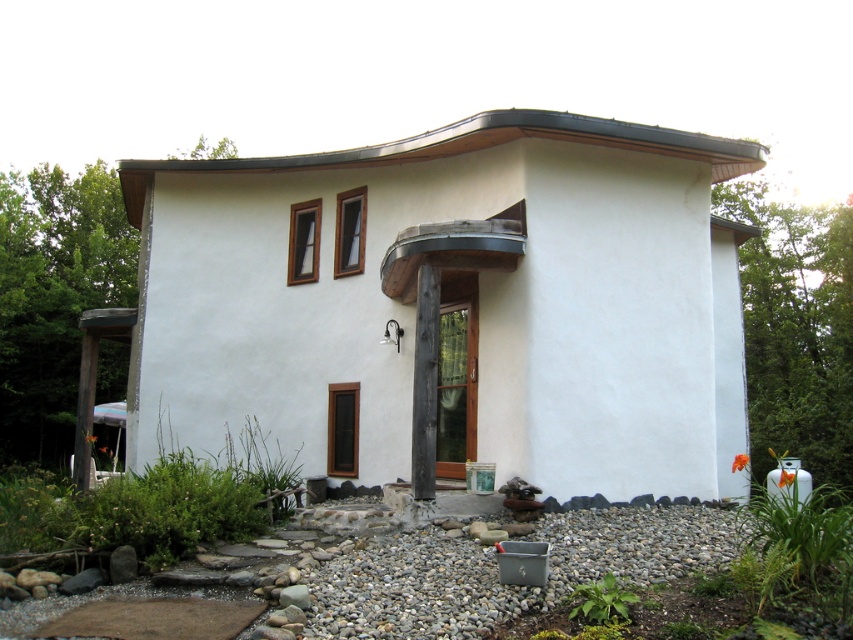
You are standing in front of the house and want to walk from the gravel pathway to the entrance door. There are two points marked on the path. The first point is at coordinate point (115, 573) and the second is at point (300, 593). Which point should you step on first as you approach the door?

You should step on point (115, 573) first because it is closer to you than point (300, 593) as you approach the door.

You are standing at the entrance of the modern house and want to place a new decorative item exactly where the gray stone at lower left is located. According to the image, what are the coordinates of the location where you should place the item?

The coordinates for the gray stone at lower left are at point (122, 564).

You are a gardener planning to plant flowers along the gravel pathway leading to the house. You notice the gray stone at lower left and the gray smooth rock at lower center. Which object is located closer to the entrance of the house?

The gray smooth rock at lower center is closer to the entrance of the house because it is positioned above the gray stone at lower left.